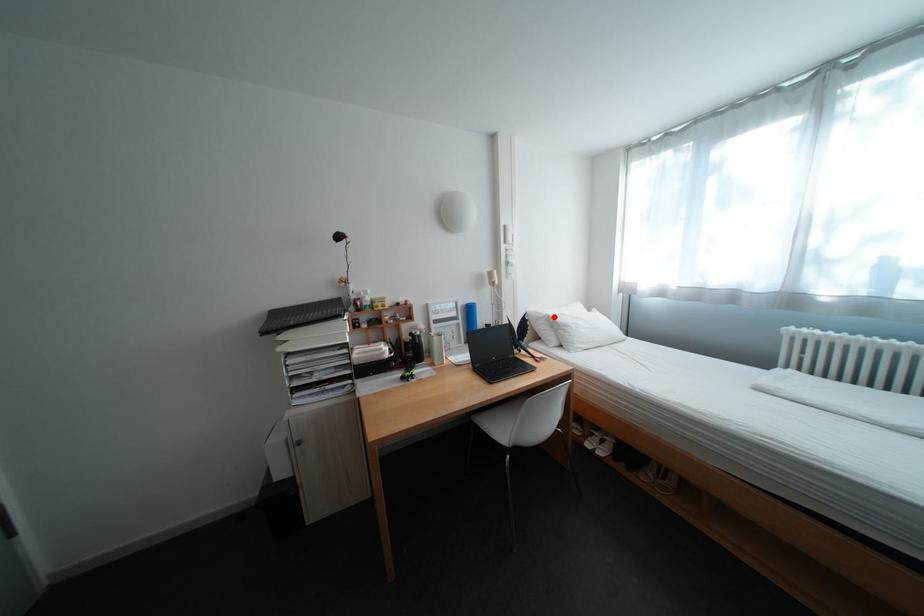
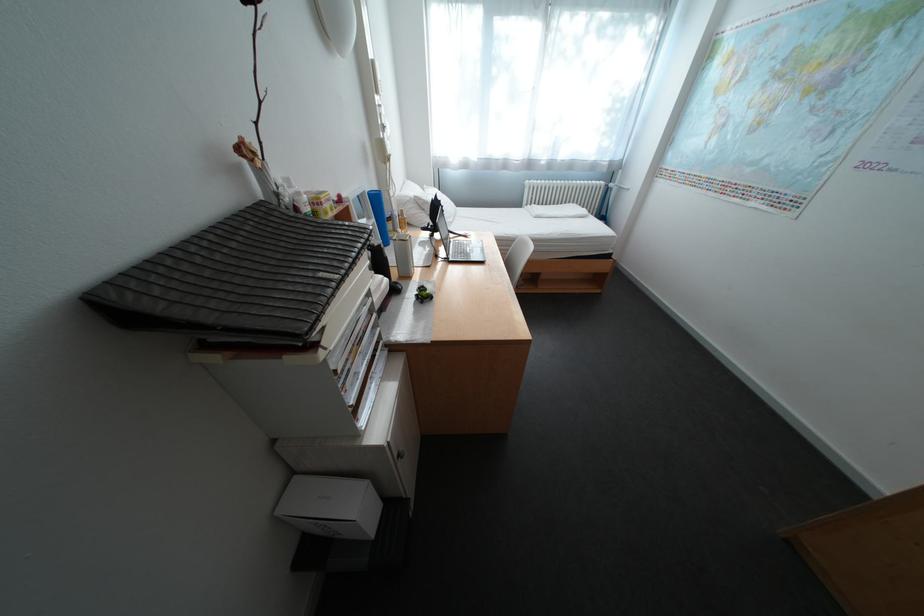
Question: I am providing you with two images of the same scene from different viewpoints. A red point is marked on the first image. Is the red point's position out of view in image 2?

Choices:
 (A) Yes
 (B) No

Answer: (B)